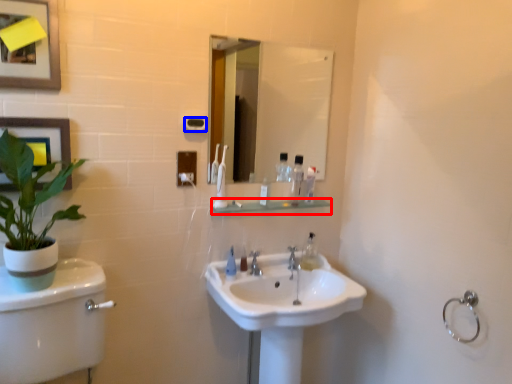
Question: Which object is further to the camera taking this photo, balustrade (highlighted by a red box) or towel bar (highlighted by a blue box)?

Choices:
 (A) balustrade
 (B) towel bar

Answer: (A)